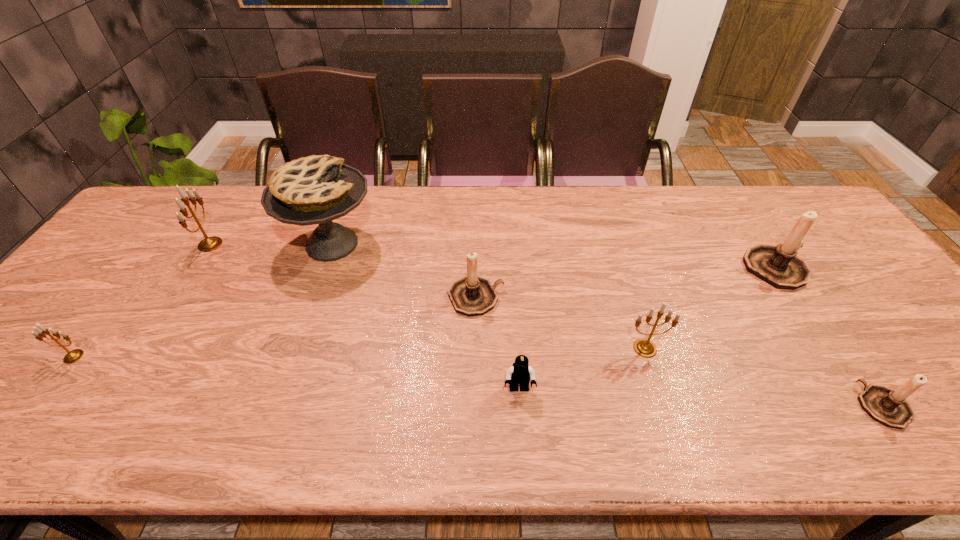
This screenshot has width=960, height=540. I want to click on free space at the far right corner of the desktop, so click(782, 198).

Image resolution: width=960 pixels, height=540 pixels. In order to click on vacant region at the near right corner of the desktop in this screenshot , I will do pyautogui.click(x=942, y=443).

At what (x,y) coordinates should I click in order to perform the action: click on free space between the third object from left to right and the second smallest brown candle holder. Please return your answer as a coordinate pair (x, y). The height and width of the screenshot is (540, 960). Looking at the image, I should click on 404,271.

Find the location of a particular element. The height and width of the screenshot is (540, 960). free space between the biggest gold candelabrum and the Lego is located at coordinates coord(365,317).

Where is `free space between the leftmost gold candelabrum and the fourth candelabrum from right to left`? This screenshot has height=540, width=960. free space between the leftmost gold candelabrum and the fourth candelabrum from right to left is located at coordinates (275, 327).

Identify the location of empty space that is in between the pie and the smallest brown candle holder. The width and height of the screenshot is (960, 540). (608, 325).

Locate an element on the screen. This screenshot has height=540, width=960. free space between the third object from left to right and the biggest brown candle holder is located at coordinates (554, 256).

Find the location of `unoccupied position between the biggest brown candle holder and the tallest object`. unoccupied position between the biggest brown candle holder and the tallest object is located at coordinates (554, 256).

The image size is (960, 540). I want to click on vacant point located between the smallest brown candle holder and the biggest brown candle holder, so click(829, 337).

You are a GUI agent. You are given a task and a screenshot of the screen. Output one action in this format:
    pyautogui.click(x=<x>, y=<y>)
    Task: Click on the free space that is in between the black Lego and the biggest brown candle holder
    
    Given the screenshot: What is the action you would take?
    pyautogui.click(x=647, y=329)